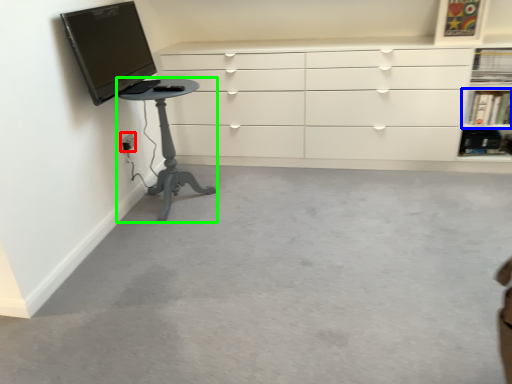
Question: Which object is positioned farthest from electric outlet (highlighted by a red box)? Select from shelf (highlighted by a blue box) and furniture (highlighted by a green box).

Choices:
 (A) shelf
 (B) furniture

Answer: (A)